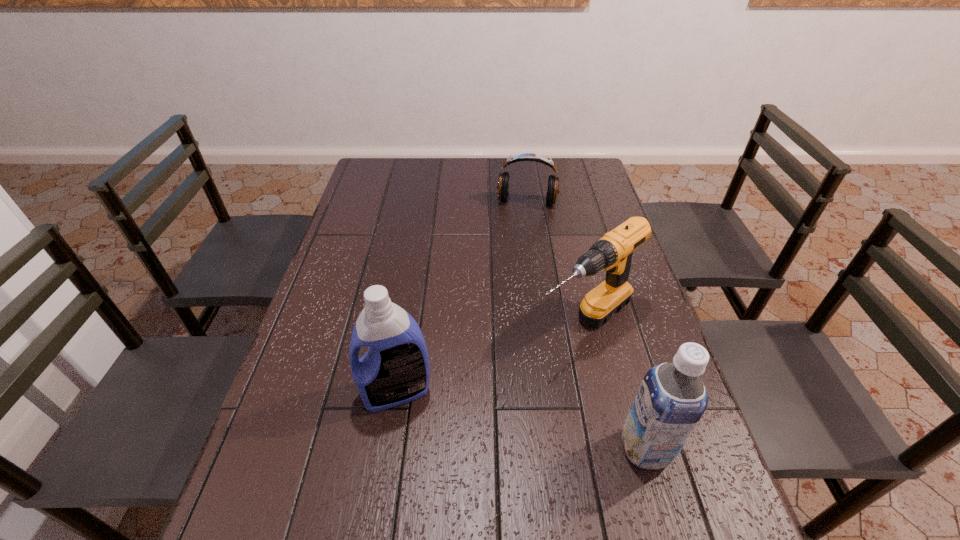
The width and height of the screenshot is (960, 540). What are the coordinates of `vacant spot on the desktop that is between the leftmost object and the nearest object and is positioned at the tip of the drill` in the screenshot? It's located at (x=479, y=410).

At what (x,y) coordinates should I click in order to perform the action: click on vacant space on the desktop that is between the third farthest object and the nearest object and is positioned on the ear cups of the headset. Please return your answer as a coordinate pair (x, y). The image size is (960, 540). Looking at the image, I should click on point(505,416).